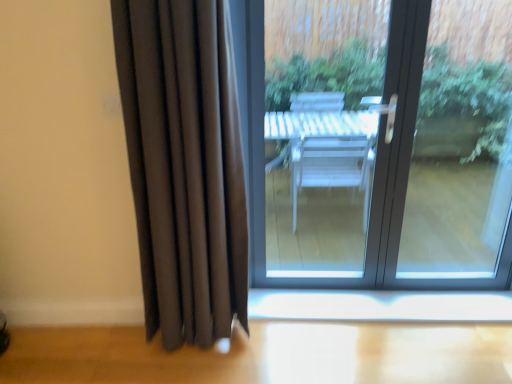
Question: Can you confirm if white glossy window sill at lower center is wider than matte glass door at center?

Choices:
 (A) yes
 (B) no

Answer: (B)

Question: Is white glossy window sill at lower center to the left of matte glass door at center from the viewer's perspective?

Choices:
 (A) no
 (B) yes

Answer: (A)

Question: Is there a large distance between white glossy window sill at lower center and matte glass door at center?

Choices:
 (A) yes
 (B) no

Answer: (A)

Question: Would you say white glossy window sill at lower center is outside matte glass door at center?

Choices:
 (A) yes
 (B) no

Answer: (A)

Question: Is white glossy window sill at lower center facing towards matte glass door at center?

Choices:
 (A) yes
 (B) no

Answer: (B)

Question: Does white glossy window sill at lower center appear on the right side of matte glass door at center?

Choices:
 (A) no
 (B) yes

Answer: (B)

Question: From the image's perspective, is matte glass door at center under white glossy window sill at lower center?

Choices:
 (A) no
 (B) yes

Answer: (A)

Question: Is the position of matte glass door at center more distant than that of white glossy window sill at lower center?

Choices:
 (A) yes
 (B) no

Answer: (B)

Question: Does matte glass door at center appear on the left side of white glossy window sill at lower center?

Choices:
 (A) yes
 (B) no

Answer: (A)

Question: Is matte glass door at center in front of white glossy window sill at lower center?

Choices:
 (A) no
 (B) yes

Answer: (B)

Question: Would you consider matte glass door at center to be distant from white glossy window sill at lower center?

Choices:
 (A) no
 (B) yes

Answer: (B)

Question: Can you confirm if matte glass door at center is smaller than white glossy window sill at lower center?

Choices:
 (A) yes
 (B) no

Answer: (B)

Question: From a real-world perspective, is matte glass door at center positioned under matte black curtain at left based on gravity?

Choices:
 (A) yes
 (B) no

Answer: (A)